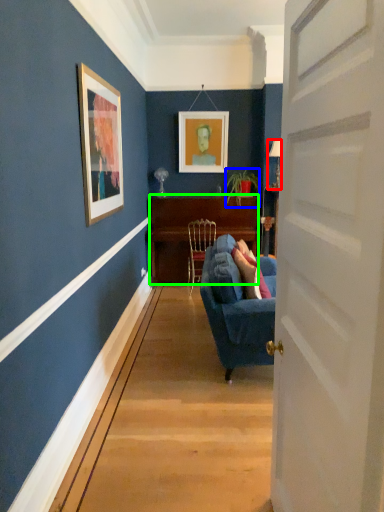
Question: Which object is positioned farthest from lamp (highlighted by a red box)? Select from houseplant (highlighted by a blue box) and desk (highlighted by a green box).

Choices:
 (A) houseplant
 (B) desk

Answer: (B)